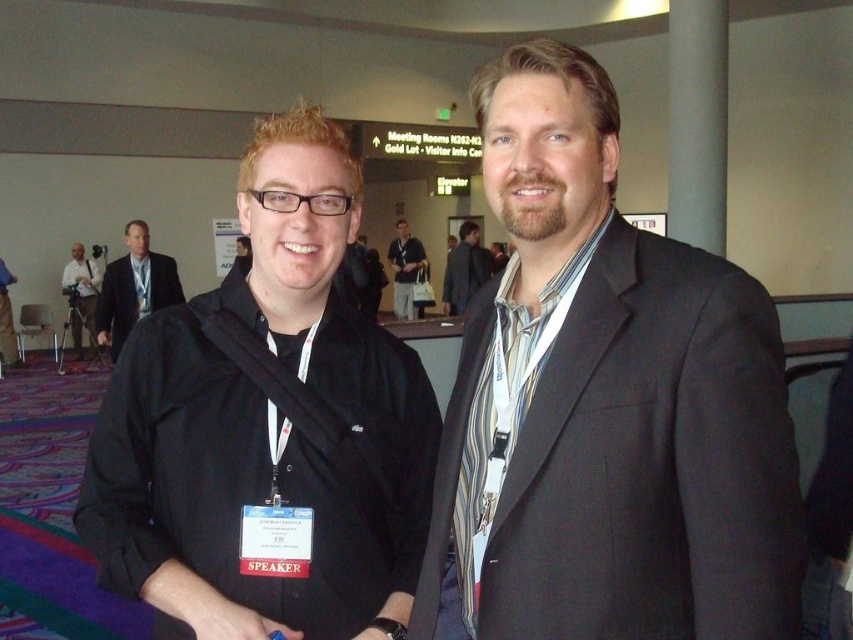
Can you confirm if matte black suit at center is thinner than dark gray suit at center?

Indeed, matte black suit at center has a lesser width compared to dark gray suit at center.

Is matte black suit at center taller than dark gray suit at center?

In fact, matte black suit at center may be shorter than dark gray suit at center.

The height and width of the screenshot is (640, 853). What do you see at coordinates (607, 403) in the screenshot? I see `matte black suit at center` at bounding box center [607, 403].

Where is `matte black suit at center`? Image resolution: width=853 pixels, height=640 pixels. matte black suit at center is located at coordinates (607, 403).

Which is in front, point (78, 323) or point (16, 364)?

Point (16, 364)

Does point (77, 355) come in front of point (1, 314)?

No, (77, 355) is further to viewer.

Where is `matte black camera at left`? The height and width of the screenshot is (640, 853). matte black camera at left is located at coordinates (80, 294).

Where is `matte black suit at center`? matte black suit at center is located at coordinates (607, 403).

Looking at this image, can you confirm if matte black suit at center is positioned above matte black jacket at left?

No.

Does point (735, 278) come farther from viewer compared to point (125, 337)?

No, it is not.

Identify the location of matte black suit at center. The height and width of the screenshot is (640, 853). (607, 403).